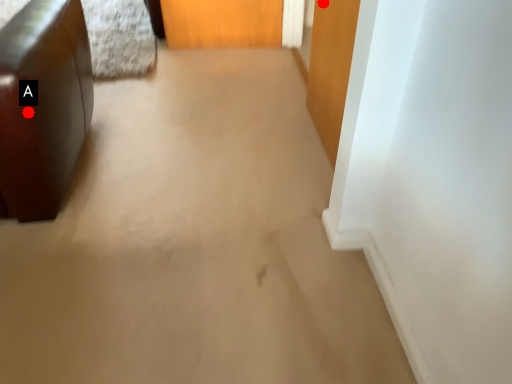
Question: Two points are circled on the image, labeled by A and B beside each circle. Among these points, which one is nearest to the camera?

Choices:
 (A) A is closer
 (B) B is closer

Answer: (A)